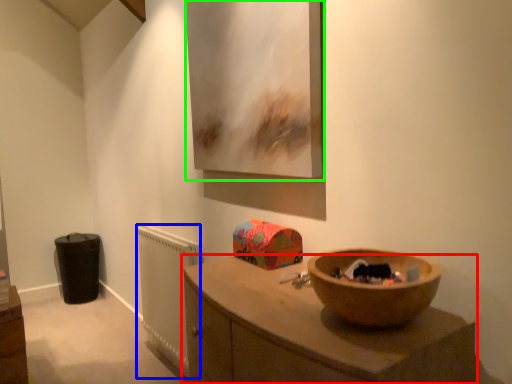
Question: Based on their relative distances, which object is nearer to countertop (highlighted by a red box)? Choose from radiator (highlighted by a blue box) and picture frame (highlighted by a green box).

Choices:
 (A) radiator
 (B) picture frame

Answer: (B)